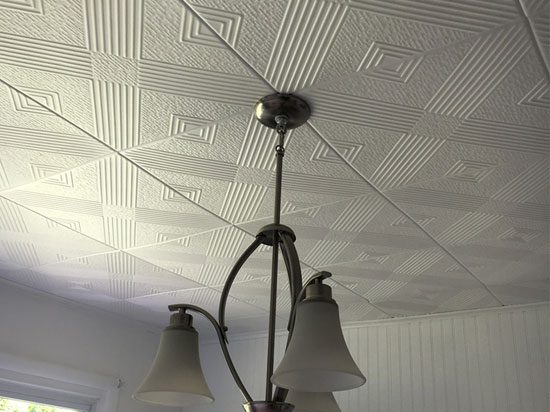
You are a GUI agent. You are given a task and a screenshot of the screen. Output one action in this format:
    pyautogui.click(x=<x>, y=<y>)
    Task: Click on the window frame
    This screenshot has width=550, height=412.
    Given the screenshot: What is the action you would take?
    pyautogui.click(x=68, y=392)